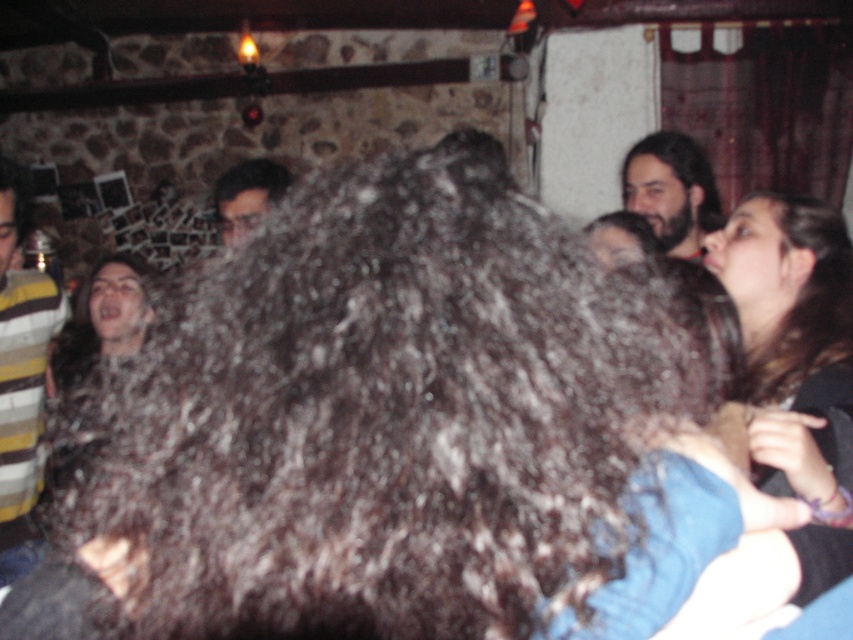
Question: In this image, where is dark curly hair at center located relative to striped wool sweater at left?

Choices:
 (A) left
 (B) right

Answer: (B)

Question: Which is farther from the striped wool sweater at left?

Choices:
 (A) dark curly hair at center
 (B) dark brown hair at upper right
 (C) matte black hair at center

Answer: (B)

Question: Can you confirm if striped wool sweater at left is bigger than matte black hair at center?

Choices:
 (A) yes
 (B) no

Answer: (A)

Question: Which point is farther to the camera?

Choices:
 (A) dark curly hair at center
 (B) dark brown hair at upper right
 (C) matte black hair at center

Answer: (B)

Question: Which of the following is the closest to the observer?

Choices:
 (A) dark brown hair at upper right
 (B) dark curly hair at center
 (C) striped wool sweater at left

Answer: (B)

Question: Can you confirm if striped wool sweater at left is positioned to the left of dark brown hair at upper right?

Choices:
 (A) no
 (B) yes

Answer: (B)